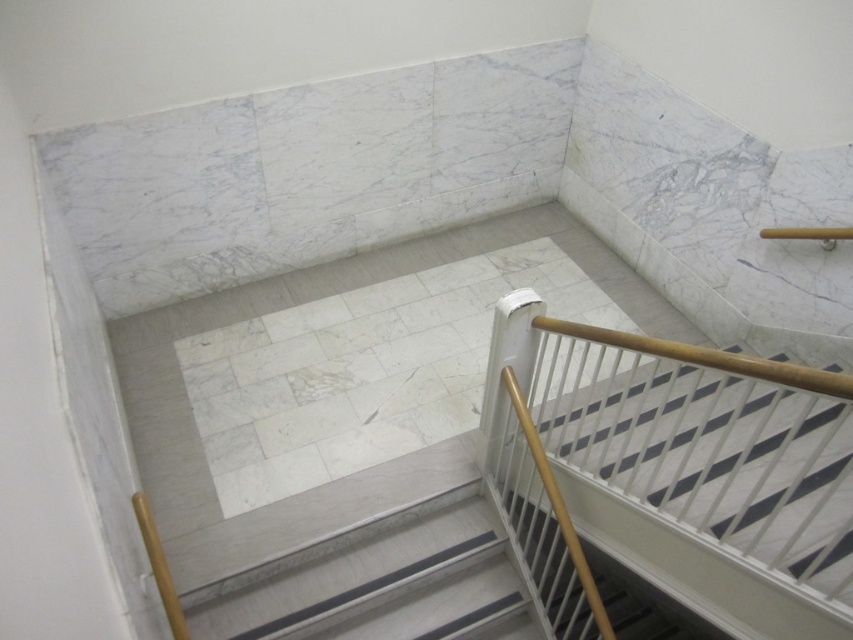
Question: Which point appears closest to the camera in this image?

Choices:
 (A) (724, 464)
 (B) (427, 499)

Answer: (A)

Question: Is white plastic railing at lower right thinner than white marble stairs at center?

Choices:
 (A) yes
 (B) no

Answer: (A)

Question: Can you confirm if white plastic railing at lower right is positioned to the right of white marble stairs at center?

Choices:
 (A) no
 (B) yes

Answer: (B)

Question: Does white plastic railing at lower right appear on the right side of white marble stairs at center?

Choices:
 (A) yes
 (B) no

Answer: (A)

Question: Among these objects, which one is farthest from the camera?

Choices:
 (A) white marble stairs at center
 (B) white plastic railing at lower right

Answer: (A)